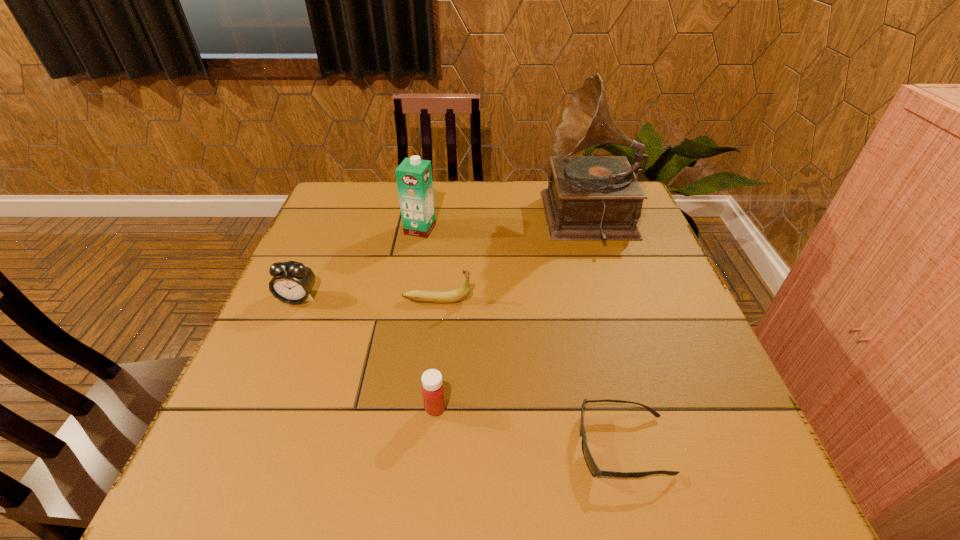
Identify the location of free space that satisfies the following two spatial constraints: 1. at the stem of the banana; 2. on the left side of the medicine. (426, 408).

Where is `vacant space that satisfies the following two spatial constraints: 1. on the front side of the fifth shortest object; 2. on the left side of the medicine`? The image size is (960, 540). vacant space that satisfies the following two spatial constraints: 1. on the front side of the fifth shortest object; 2. on the left side of the medicine is located at coordinates (390, 408).

Image resolution: width=960 pixels, height=540 pixels. I want to click on free space that satisfies the following two spatial constraints: 1. from the horn of the record player; 2. on the front side of the leftmost object, so click(616, 298).

In order to click on vacant point that satisfies the following two spatial constraints: 1. from the horn of the record player; 2. on the front side of the leftmost object in this screenshot , I will do `click(616, 298)`.